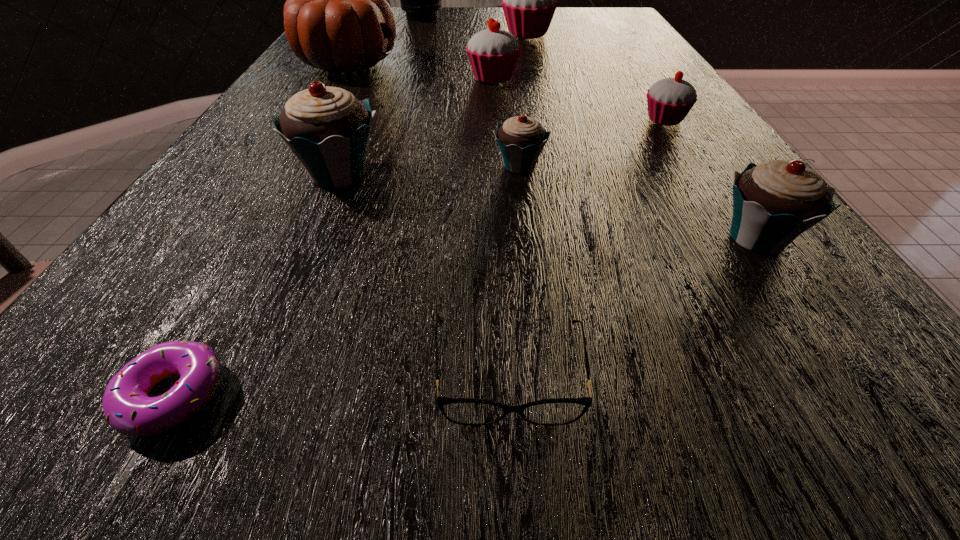
Identify the location of black telephoto lens. The image size is (960, 540). (421, 0).

I want to click on telephoto lens, so [x=421, y=0].

Where is `orange pumpkin`? The image size is (960, 540). orange pumpkin is located at coordinates (336, 18).

Where is `the ninth nearest object`? The width and height of the screenshot is (960, 540). the ninth nearest object is located at coordinates (529, 0).

Where is `the biggest pink cupcake`? The image size is (960, 540). the biggest pink cupcake is located at coordinates (529, 0).

The height and width of the screenshot is (540, 960). I want to click on the leftmost teal cupcake, so click(x=328, y=129).

In order to click on the biggest teal cupcake in this screenshot , I will do `click(328, 129)`.

Locate an element on the screen. the fifth nearest cupcake is located at coordinates (493, 53).

You are a GUI agent. You are given a task and a screenshot of the screen. Output one action in this format:
    pyautogui.click(x=<x>, y=<y>)
    Task: Click on the second nearest pink cupcake
    Image resolution: width=960 pixels, height=540 pixels.
    Given the screenshot: What is the action you would take?
    pyautogui.click(x=493, y=53)

Where is `the third nearest object`? The height and width of the screenshot is (540, 960). the third nearest object is located at coordinates click(773, 203).